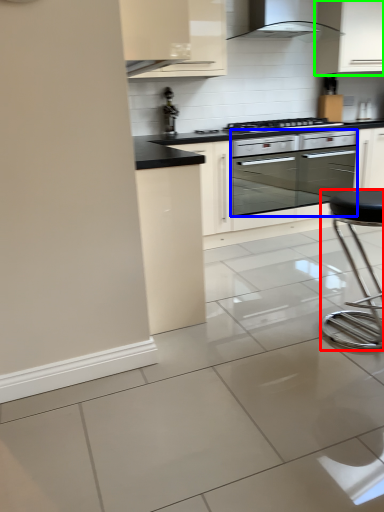
Question: Based on their relative distances, which object is farther from bar stool (highlighted by a red box)? Choose from oven (highlighted by a blue box) and cabinetry (highlighted by a green box).

Choices:
 (A) oven
 (B) cabinetry

Answer: (B)